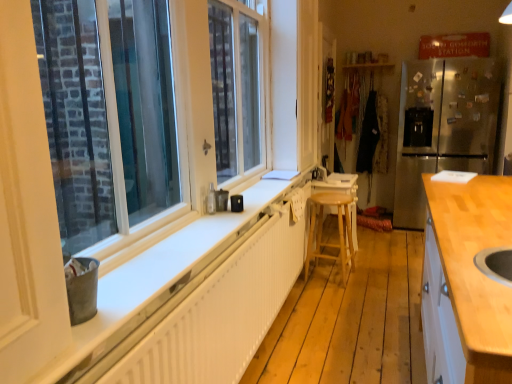
The height and width of the screenshot is (384, 512). Find the location of `free space in front of wooden stool at center`. free space in front of wooden stool at center is located at coordinates (368, 275).